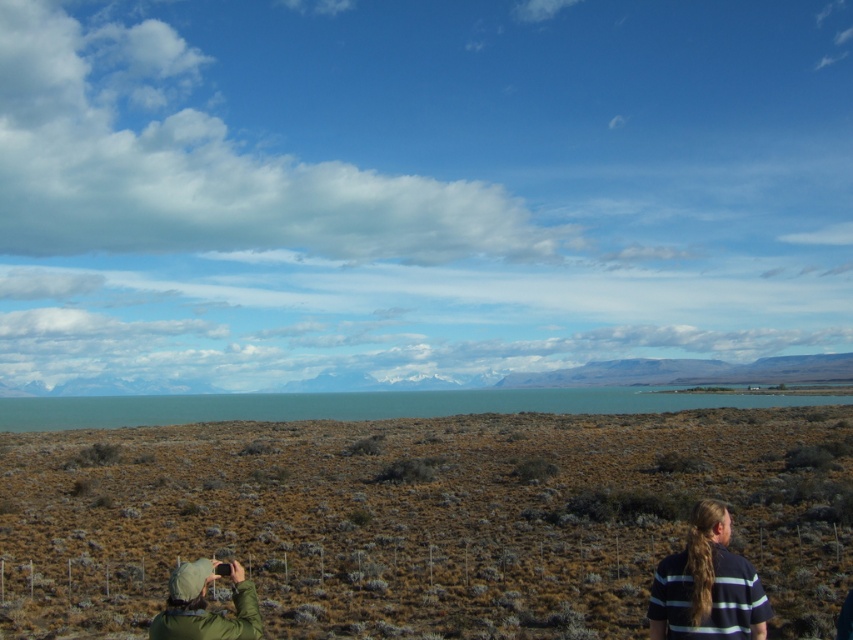
You are a landscape photographer planning to capture the entire scene in one shot. Given that the brown dry grassland at center and the teal glossy water at center are both in the frame, which of these two elements takes up more area in the photo?

The teal glossy water at center occupies more area than the brown dry grassland at center in the photo, as it is stated that the brown dry grassland at center occupies less space than the teal glossy water at center.